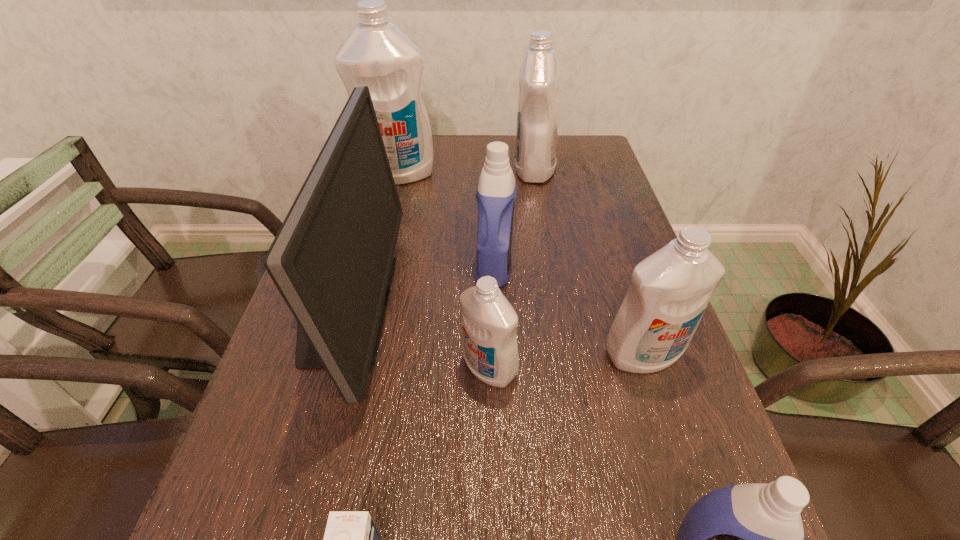
Locate an element on the screen. the tallest object is located at coordinates (377, 54).

The image size is (960, 540). What are the coordinates of `the leftmost white detergent` in the screenshot? It's located at 377,54.

Identify the location of the third white detergent from left to right. The height and width of the screenshot is (540, 960). pyautogui.click(x=539, y=78).

At what (x,y) coordinates should I click in order to perform the action: click on the sixth object from left to right. Please return your answer as a coordinate pair (x, y). Looking at the image, I should click on (539, 78).

Find the location of a particular element. This screenshot has width=960, height=540. black computer monitor is located at coordinates (332, 260).

Image resolution: width=960 pixels, height=540 pixels. Identify the location of the rightmost white detergent. (669, 290).

You are a GUI agent. You are given a task and a screenshot of the screen. Output one action in this format:
    pyautogui.click(x=<x>, y=<y>)
    Task: Click on the fourth nearest detergent
    Image resolution: width=960 pixels, height=540 pixels.
    Given the screenshot: What is the action you would take?
    pyautogui.click(x=496, y=191)

The height and width of the screenshot is (540, 960). I want to click on the left blue detergent, so click(x=496, y=191).

I want to click on the second white detergent from left to right, so click(x=489, y=322).

Find the location of a particular element. free point located on the front of the leftmost white detergent is located at coordinates (371, 279).